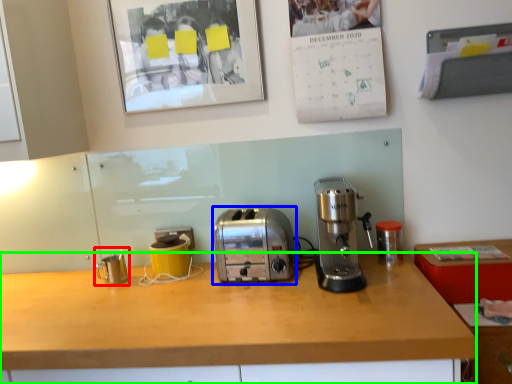
Question: Estimate the real-world distances between objects in this image. Which object is closer to appliance (highlighted by a red box), toaster (highlighted by a blue box) or desk (highlighted by a green box)?

Choices:
 (A) toaster
 (B) desk

Answer: (A)